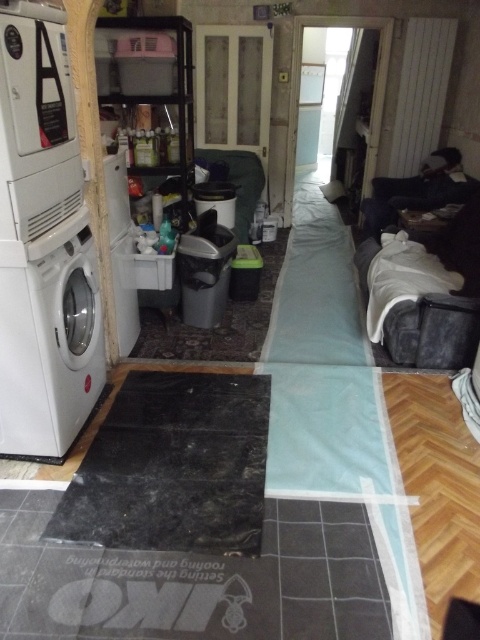
You are a construction worker in the room and you need to place a new tool box at point (48,340). However, there is already an object at that location. What object is blocking the way?

The white glossy washing machine at left is located at point (48,340), so it is blocking the way.

You are moving a new bookshelf into the room and need to know which object is taller between the white glossy washing machine at left and the velvet grey sofa at right to ensure it fits through the doorway. Which one is taller?

The white glossy washing machine at left is taller than the velvet grey sofa at right, so the bookshelf must be shorter than the washing machine to fit through the doorway.

You are moving a new piece of furniture into the room and need to navigate around the white glossy washing machine at left and the velvet grey sofa at right. Which object should you move around first if you are entering from the door located at the far end of the room opposite the washer and dryer?

The white glossy washing machine at left is positioned on the left side of the velvet grey sofa at right, so you should move around the white glossy washing machine at left first since it is closer to the entrance when entering from the door opposite the washer and dryer.